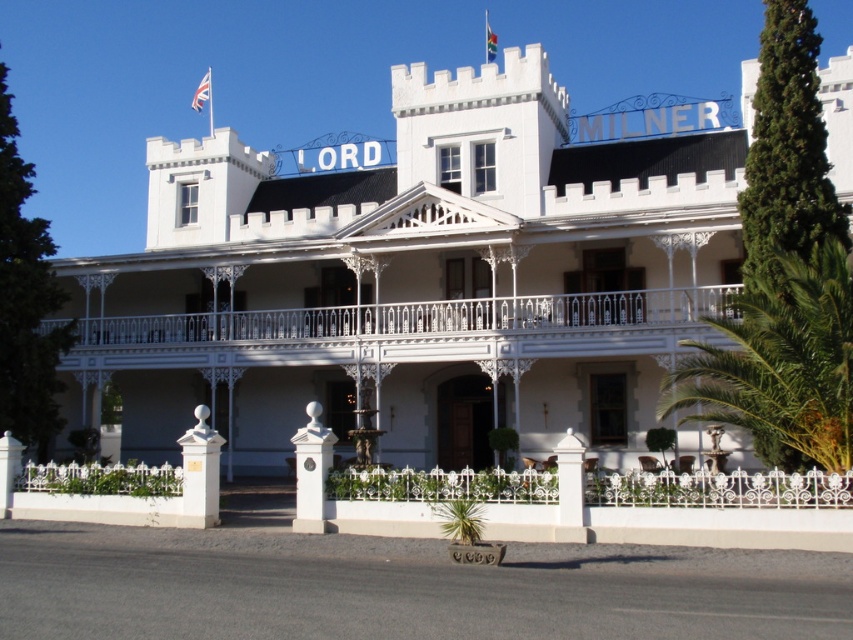
Question: Can you confirm if white wrought iron fence at center is positioned below green leafy palm at right?

Choices:
 (A) yes
 (B) no

Answer: (B)

Question: Can you confirm if white wrought iron fence at center is positioned to the right of green leafy palm at right?

Choices:
 (A) yes
 (B) no

Answer: (B)

Question: Which point is farther to the camera?

Choices:
 (A) white wrought iron fence at center
 (B) green leafy palm at right

Answer: (A)

Question: Considering the relative positions of white wrought iron fence at center and green leafy palm at right in the image provided, where is white wrought iron fence at center located with respect to green leafy palm at right?

Choices:
 (A) right
 (B) left

Answer: (B)